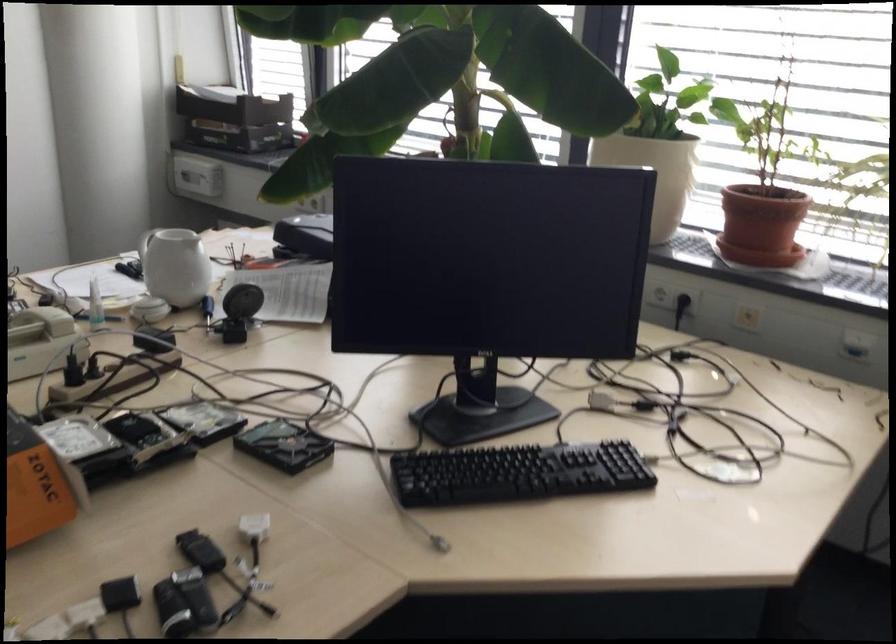
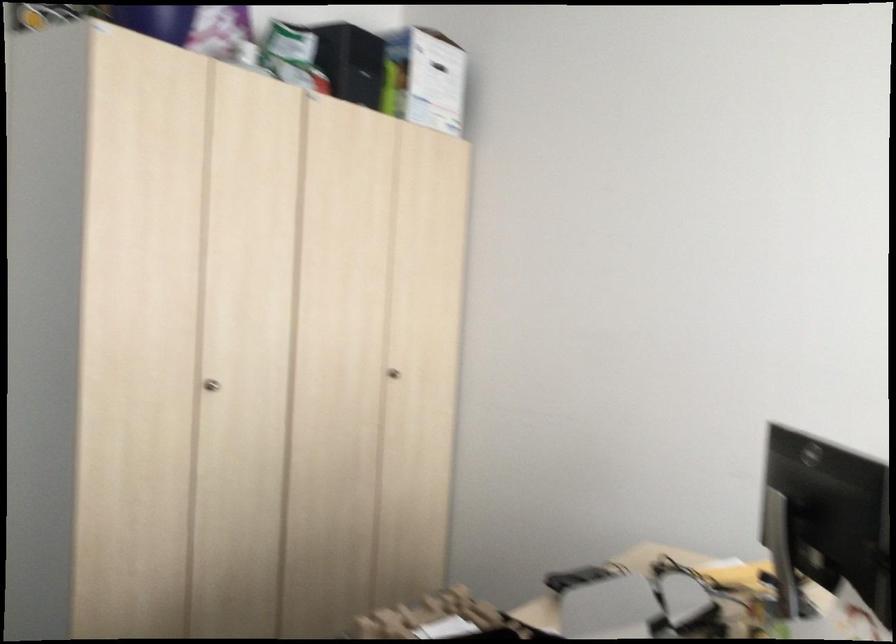
Question: The camera is either moving clockwise (left) or counter-clockwise (right) around the object. The first image is from the beginning of the video and the second image is from the end. Is the camera moving left or right when shooting the video?

Choices:
 (A) Left
 (B) Right

Answer: (B)